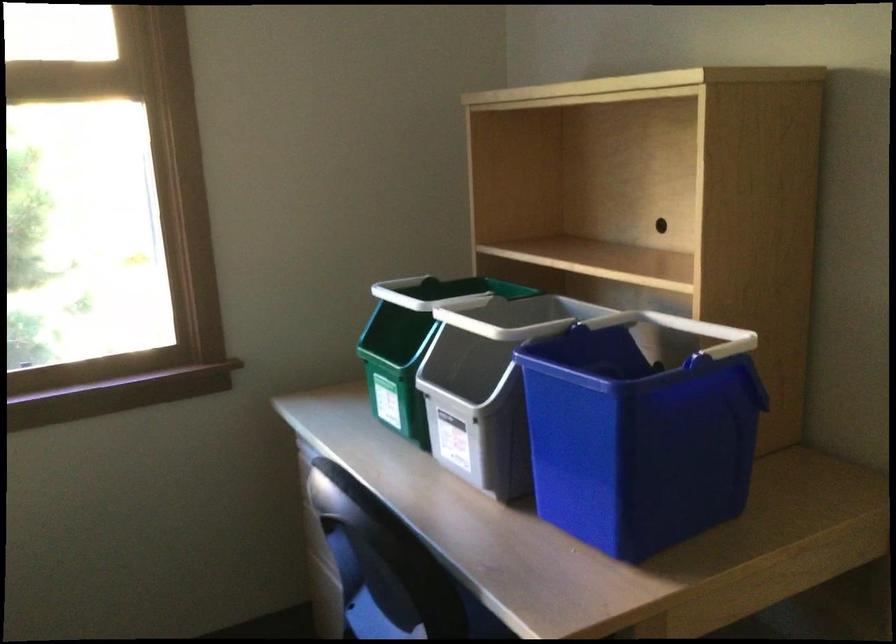
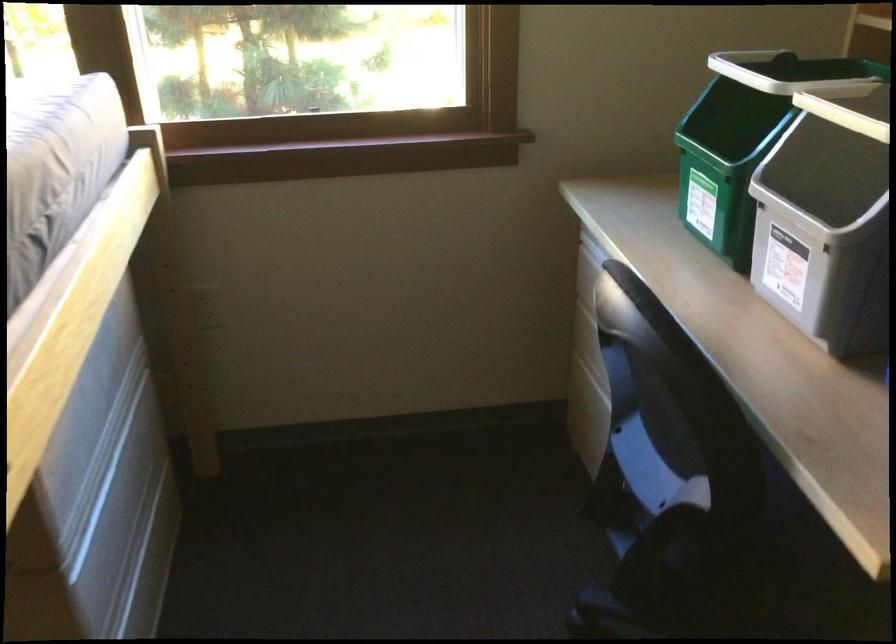
The images are taken continuously from a first-person perspective. In which direction are you moving?

The movement direction of the cameraman is left, forward.